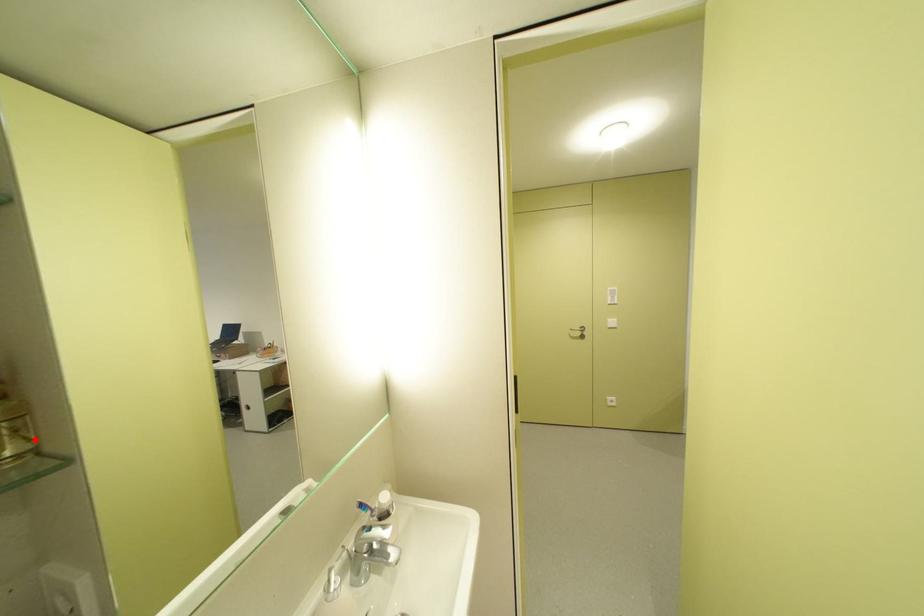
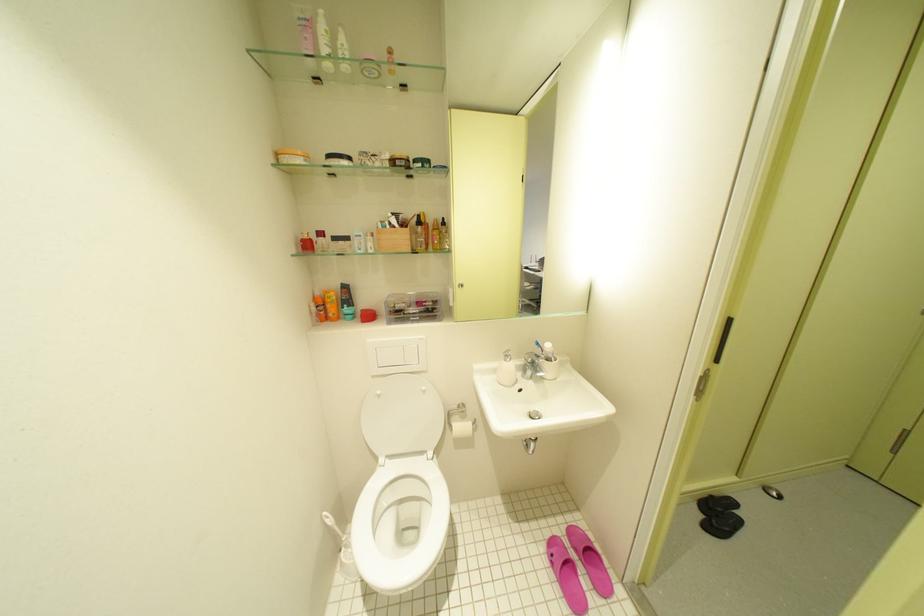
Question: I am providing you with two images of the same scene from different viewpoints. A red point is marked on the first image. Is the red point's position out of view in image 2?

Choices:
 (A) Yes
 (B) No

Answer: (A)